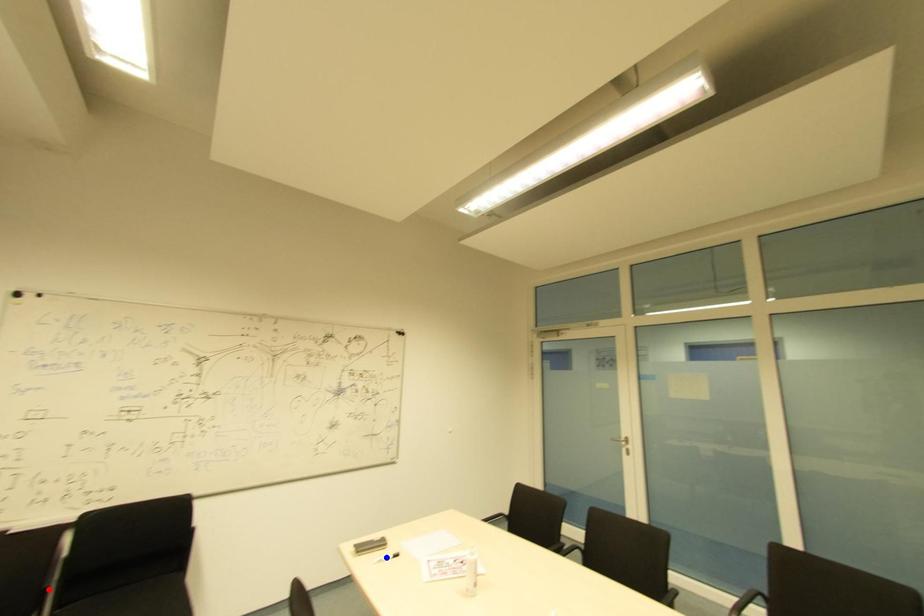
Question: Two points are marked on the image. Which point is closer to the camera?

Choices:
 (A) Blue point is closer.
 (B) Red point is closer.

Answer: (B)